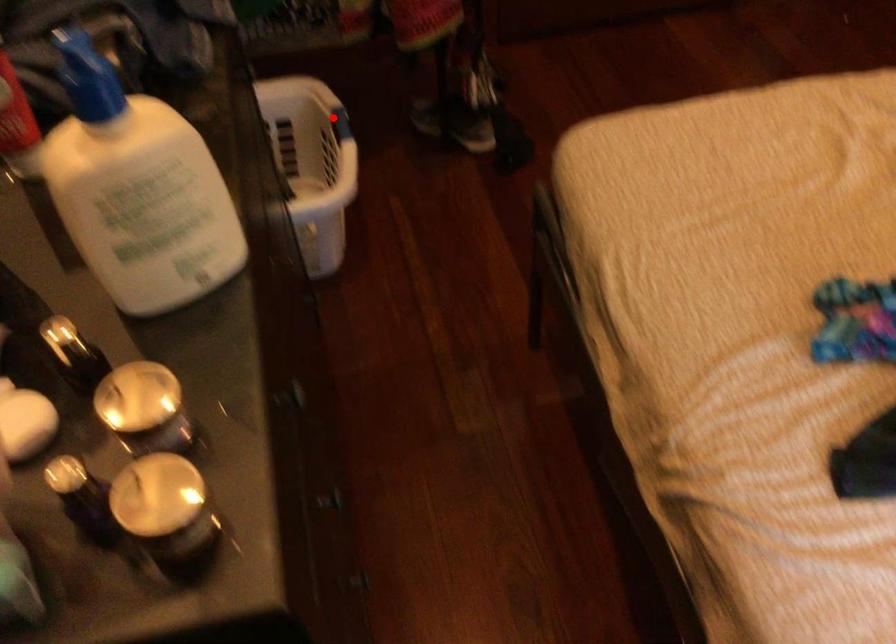
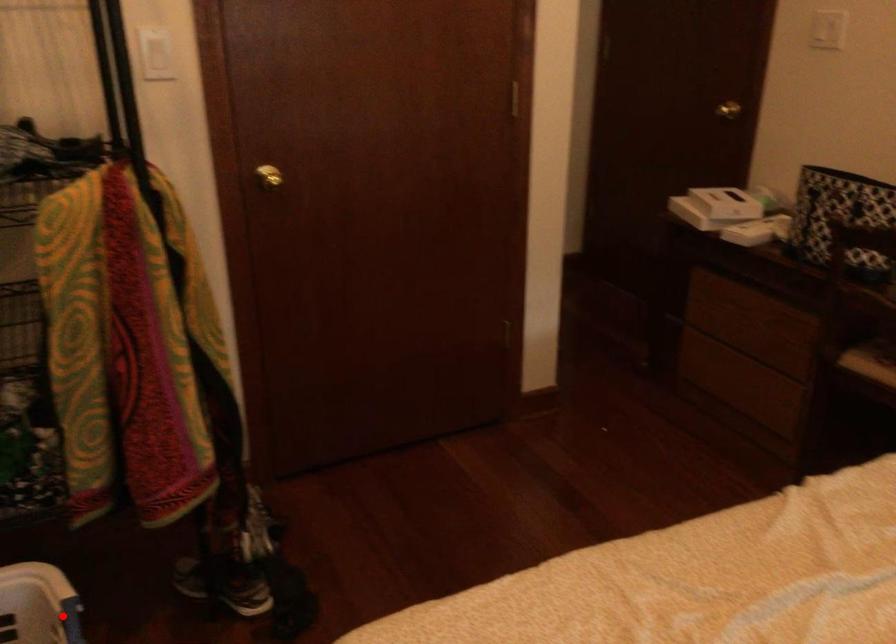
I am providing you with two images of the same scene from different viewpoints. A red point is marked on the first image and another point is marked on the second image. Does the point marked in image1 correspond to the same location as the one in image2?

Yes